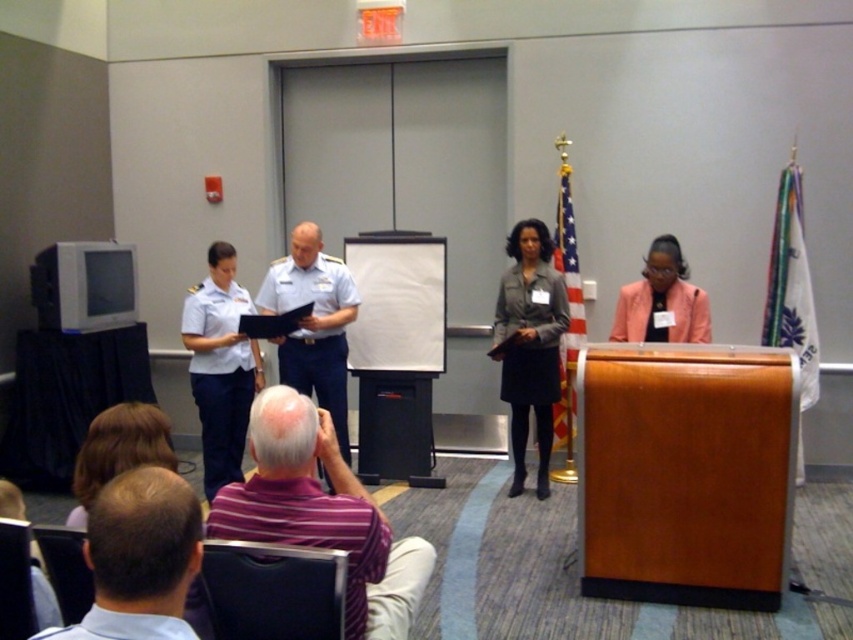
Consider the image. Between white fabric uniform at center and white fabric shirt at lower left, which one has less height?

white fabric shirt at lower left

Between white fabric uniform at center and white fabric shirt at lower left, which one has more height?

Standing taller between the two is white fabric uniform at center.

Between point (199, 360) and point (53, 634), which one is positioned in front?

Point (53, 634) is in front.

Where is `white fabric uniform at center`? The height and width of the screenshot is (640, 853). white fabric uniform at center is located at coordinates (219, 374).

Is white uniform at center thinner than white fabric shirt at lower left?

No, white uniform at center is not thinner than white fabric shirt at lower left.

Which of these two, white uniform at center or white fabric shirt at lower left, stands taller?

With more height is white uniform at center.

Is point (337, 388) behind point (90, 616)?

Yes.

You are a GUI agent. You are given a task and a screenshot of the screen. Output one action in this format:
    pyautogui.click(x=<x>, y=<y>)
    Task: Click on the white uniform at center
    
    Given the screenshot: What is the action you would take?
    pyautogui.click(x=312, y=323)

Can you confirm if light brown hair at lower left is positioned above blonde hair at lower left?

Actually, light brown hair at lower left is below blonde hair at lower left.

Locate an element on the screen. This screenshot has height=640, width=853. light brown hair at lower left is located at coordinates (138, 557).